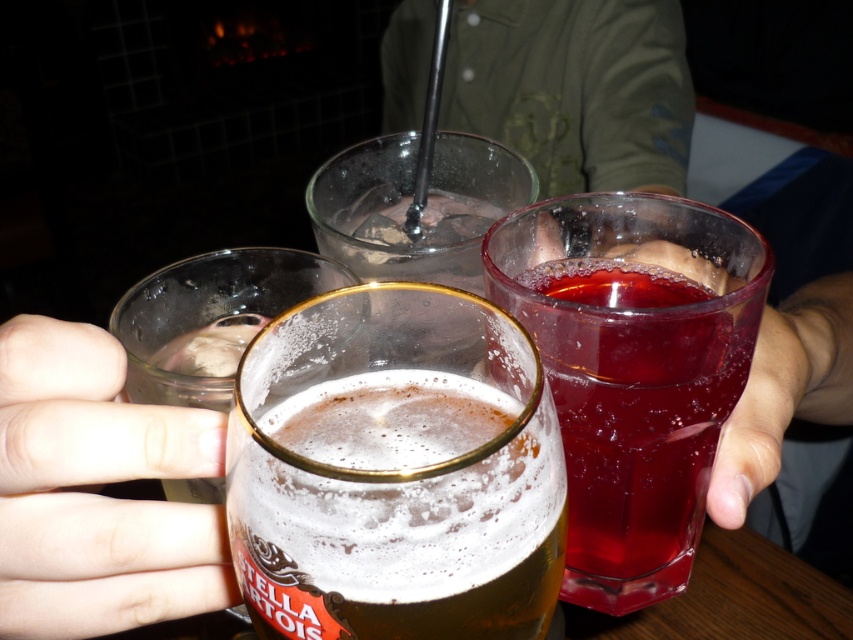
Consider the image. You are at a party and want to grab the foamy golden beer at center. There is an empty glass 13.01 centimeters away from it. Can you reach the beer without moving your hand?

The empty glass is 13.01 centimeters away from the foamy golden beer at center. Since the distance is more than typical hand reach without moving, you would need to move your hand to grab it.

You are at a party and want to pour a drink into the widest glass. Which glass should you choose between the white matte glass at lower left and the translucent glass at center?

The translucent glass at center is wider than the white matte glass at lower left, so you should choose the translucent glass at center.